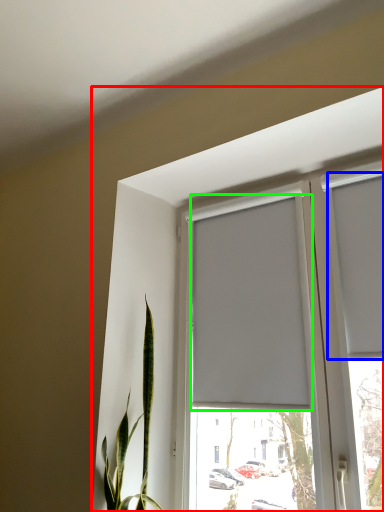
Question: Estimate the real-world distances between objects in this image. Which object is farther from window (highlighted by a red box), curtain (highlighted by a blue box) or curtain (highlighted by a green box)?

Choices:
 (A) curtain
 (B) curtain

Answer: (A)